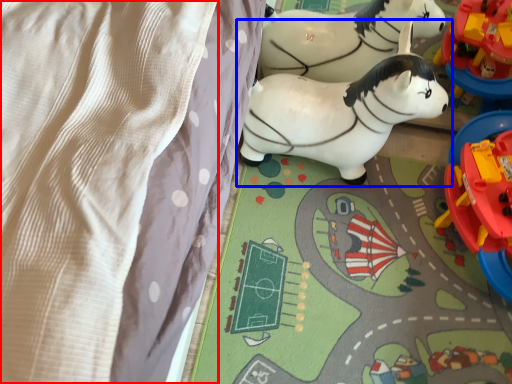
Question: Which object appears farthest to the camera in this image, blanket (highlighted by a red box) or toy (highlighted by a blue box)?

Choices:
 (A) blanket
 (B) toy

Answer: (B)